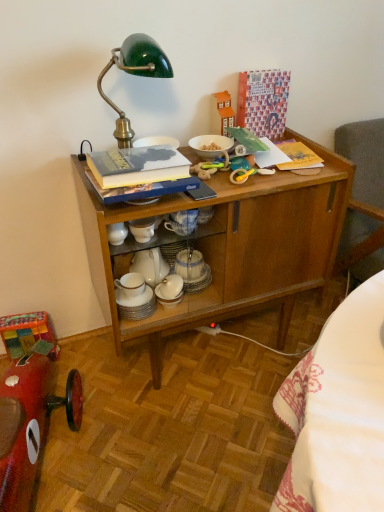
Question: Does wooden cabinet at center have a larger size compared to white glossy bowl at upper center, arranged as the 1th tableware when viewed from the right?

Choices:
 (A) no
 (B) yes

Answer: (B)

Question: Does wooden cabinet at center have a greater width compared to white glossy bowl at upper center, the 1th tableware in the top-to-bottom sequence?

Choices:
 (A) yes
 (B) no

Answer: (A)

Question: Is wooden cabinet at center beside white glossy bowl at upper center, the second tableware in the left-to-right sequence?

Choices:
 (A) no
 (B) yes

Answer: (A)

Question: Is white glossy bowl at upper center, arranged as the 1th tableware when viewed from the right, completely or partially inside wooden cabinet at center?

Choices:
 (A) yes
 (B) no

Answer: (A)

Question: Could you tell me if wooden cabinet at center is facing white glossy bowl at upper center, arranged as the second tableware when ordered from the bottom?

Choices:
 (A) yes
 (B) no

Answer: (B)

Question: Considering the positions of wooden cabinet at center and hardcover book at upper center in the image, is wooden cabinet at center taller or shorter than hardcover book at upper center?

Choices:
 (A) short
 (B) tall

Answer: (B)

Question: From the image's perspective, is wooden cabinet at center located above or below hardcover book at upper center?

Choices:
 (A) below
 (B) above

Answer: (A)

Question: In the image, is wooden cabinet at center on the left side or the right side of hardcover book at upper center?

Choices:
 (A) right
 (B) left

Answer: (A)

Question: Based on their sizes in the image, would you say wooden cabinet at center is bigger or smaller than hardcover book at upper center?

Choices:
 (A) big
 (B) small

Answer: (A)

Question: Considering the positions of white porcelain cups at center, which is counted as the second tableware, starting from the right, and shiny red toy car at lower left in the image, is white porcelain cups at center, which is counted as the second tableware, starting from the right, wider or thinner than shiny red toy car at lower left?

Choices:
 (A) thin
 (B) wide

Answer: (A)

Question: Is white porcelain cups at center, which is counted as the second tableware, starting from the right, taller or shorter than shiny red toy car at lower left?

Choices:
 (A) tall
 (B) short

Answer: (B)

Question: Considering their positions, is white porcelain cups at center, which is counted as the second tableware, starting from the right, located in front of or behind shiny red toy car at lower left?

Choices:
 (A) behind
 (B) front

Answer: (A)

Question: From a real-world perspective, is white porcelain cups at center, which is counted as the second tableware, starting from the right, physically located above or below shiny red toy car at lower left?

Choices:
 (A) below
 (B) above

Answer: (B)

Question: Do you think shiny red toy car at lower left is within white glossy bowl at upper center, arranged as the second tableware when ordered from the bottom, or outside of it?

Choices:
 (A) outside
 (B) inside

Answer: (A)

Question: In terms of height, does shiny red toy car at lower left look taller or shorter compared to white glossy bowl at upper center, the second tableware in the left-to-right sequence?

Choices:
 (A) tall
 (B) short

Answer: (A)